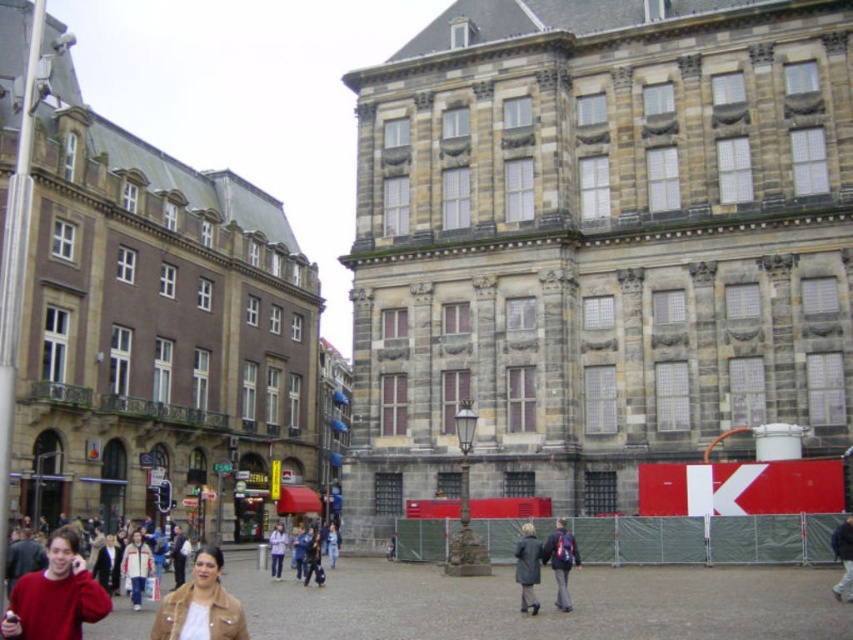
You are standing in the middle of the urban scene and see two points marked in the image. Which point is closer to you, point (190,620) or point (850,596)?

Point (190,620) is in front of point (850,596), so it is closer to you.

You are a fashion designer observing the urban scene. You notice the matte red sweater at lower left and the dark gray jacket at center. Which clothing item would be more suitable for a winter collection that emphasizes warmth and bulkiness?

The matte red sweater at lower left is larger in size compared to the dark gray jacket at center, making it more suitable for a winter collection focused on warmth and bulkiness.

You are a delivery person carrying a package that requires a 30 meter clearance path to avoid damage. You need to move from the brown leather jacket at lower left to the dark blue jacket at center. Is the distance sufficient for your delivery route?

The distance between the brown leather jacket at lower left and dark blue jacket at center is 26.17 meters. Since the required clearance is 30 meters, the path is not long enough. You need to find an alternative route.